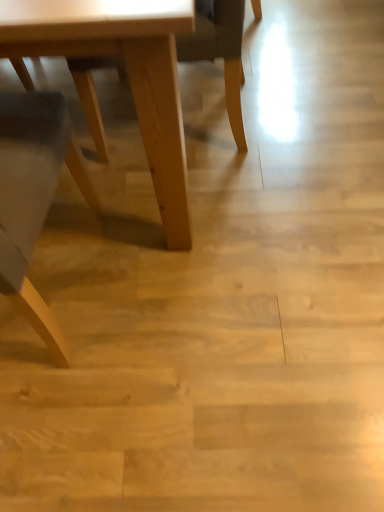
The width and height of the screenshot is (384, 512). In order to click on vacant space underneath light wood table at lower left (from a real-world perspective) in this screenshot , I will do `click(85, 238)`.